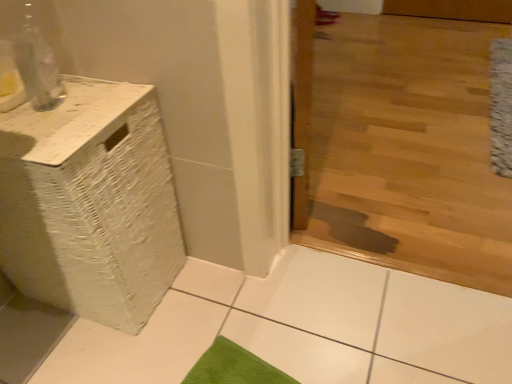
Question: Is point (499, 137) positioned closer to the camera than point (10, 147)?

Choices:
 (A) farther
 (B) closer

Answer: (A)

Question: From a real-world perspective, is white textured mat at right above or below white woven basket at left?

Choices:
 (A) above
 (B) below

Answer: (B)

Question: Is white textured mat at right inside the boundaries of white woven basket at left, or outside?

Choices:
 (A) inside
 (B) outside

Answer: (B)

Question: Is white woven basket at left to the left or to the right of white textured mat at right in the image?

Choices:
 (A) left
 (B) right

Answer: (A)

Question: Is white woven basket at left in front of or behind white textured mat at right in the image?

Choices:
 (A) behind
 (B) front

Answer: (B)

Question: Is point (16, 235) closer or farther from the camera than point (496, 44)?

Choices:
 (A) farther
 (B) closer

Answer: (B)

Question: From a real-world perspective, relative to white textured mat at right, is white woven basket at left vertically above or below?

Choices:
 (A) above
 (B) below

Answer: (A)